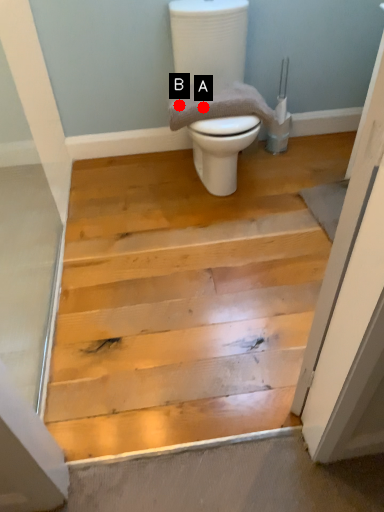
Question: Two points are circled on the image, labeled by A and B beside each circle. Which point is farther to the camera?

Choices:
 (A) A is further
 (B) B is further

Answer: (B)